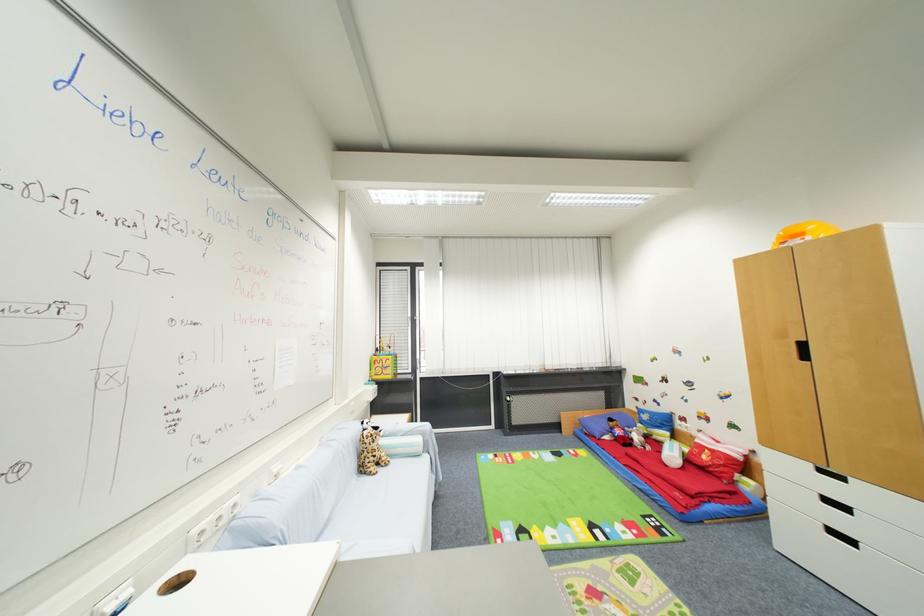
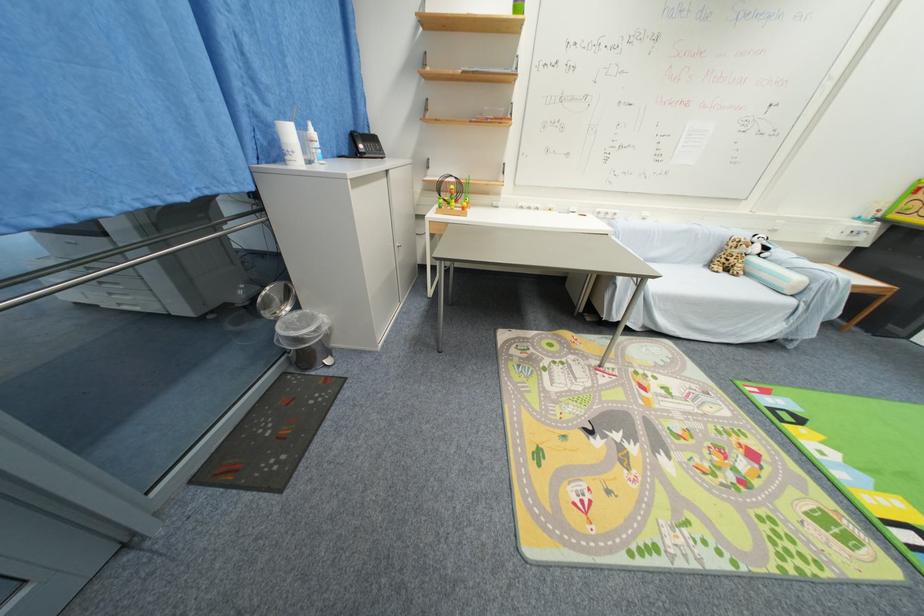
Where in the second image is the point corresponding to the point at 367,472 from the first image?

(714, 265)